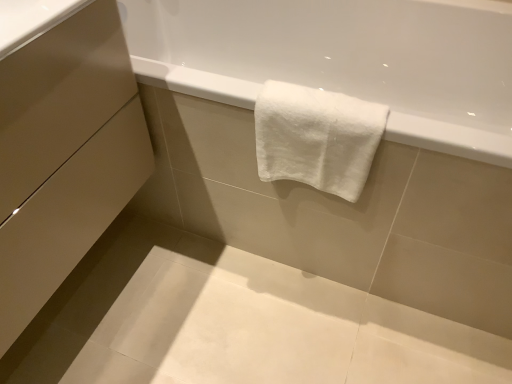
Question: Is matte beige drawer at lower left, marked as the 1th drawer in a bottom-to-top arrangement, outside of matte beige drawer at lower left, which is the 1th drawer from top to bottom?

Choices:
 (A) no
 (B) yes

Answer: (B)

Question: From the image's perspective, is matte beige drawer at lower left, marked as the 1th drawer in a bottom-to-top arrangement, on top of matte beige drawer at lower left, which is the 1th drawer from top to bottom?

Choices:
 (A) yes
 (B) no

Answer: (B)

Question: Does matte beige drawer at lower left, marked as the 1th drawer in a bottom-to-top arrangement, come in front of matte beige drawer at lower left, the second drawer positioned from the bottom?

Choices:
 (A) no
 (B) yes

Answer: (B)

Question: Does matte beige drawer at lower left, marked as the 2th drawer in a top-to-bottom arrangement, have a smaller size compared to matte beige drawer at lower left, the second drawer positioned from the bottom?

Choices:
 (A) no
 (B) yes

Answer: (A)

Question: Is matte beige drawer at lower left, which is the 1th drawer from top to bottom, completely or partially inside matte beige drawer at lower left, marked as the 2th drawer in a top-to-bottom arrangement?

Choices:
 (A) yes
 (B) no

Answer: (A)

Question: From a real-world perspective, is matte beige drawer at lower left, marked as the 1th drawer in a bottom-to-top arrangement, positioned under matte beige drawer at lower left, which is the 1th drawer from top to bottom, based on gravity?

Choices:
 (A) no
 (B) yes

Answer: (B)

Question: Can you confirm if matte beige drawer at lower left, which is the 1th drawer from top to bottom, is wider than white cotton towel at upper center?

Choices:
 (A) yes
 (B) no

Answer: (A)

Question: Does matte beige drawer at lower left, the second drawer positioned from the bottom, turn towards white cotton towel at upper center?

Choices:
 (A) yes
 (B) no

Answer: (B)

Question: Considering the relative sizes of matte beige drawer at lower left, the second drawer positioned from the bottom, and white cotton towel at upper center in the image provided, is matte beige drawer at lower left, the second drawer positioned from the bottom, smaller than white cotton towel at upper center?

Choices:
 (A) no
 (B) yes

Answer: (A)

Question: Can you confirm if matte beige drawer at lower left, the second drawer positioned from the bottom, is positioned to the left of white cotton towel at upper center?

Choices:
 (A) yes
 (B) no

Answer: (A)

Question: Can we say matte beige drawer at lower left, which is the 1th drawer from top to bottom, lies outside white cotton towel at upper center?

Choices:
 (A) yes
 (B) no

Answer: (A)

Question: Is matte beige drawer at lower left, which is the 1th drawer from top to bottom, bigger than white cotton towel at upper center?

Choices:
 (A) no
 (B) yes

Answer: (B)

Question: Is white cotton towel at upper center a part of matte beige drawer at lower left, marked as the 1th drawer in a bottom-to-top arrangement?

Choices:
 (A) no
 (B) yes

Answer: (A)